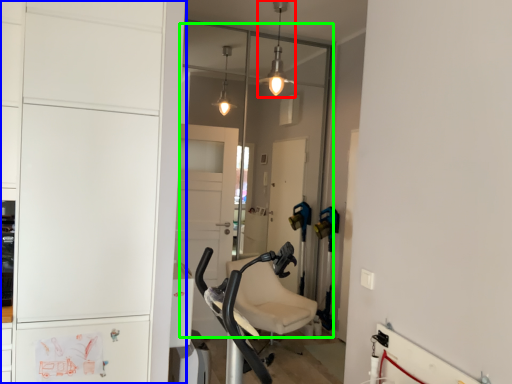
Question: Estimate the real-world distances between objects in this image. Which object is farther from light fixture (highlighted by a red box), cabinetry (highlighted by a blue box) or glass door (highlighted by a green box)?

Choices:
 (A) cabinetry
 (B) glass door

Answer: (A)